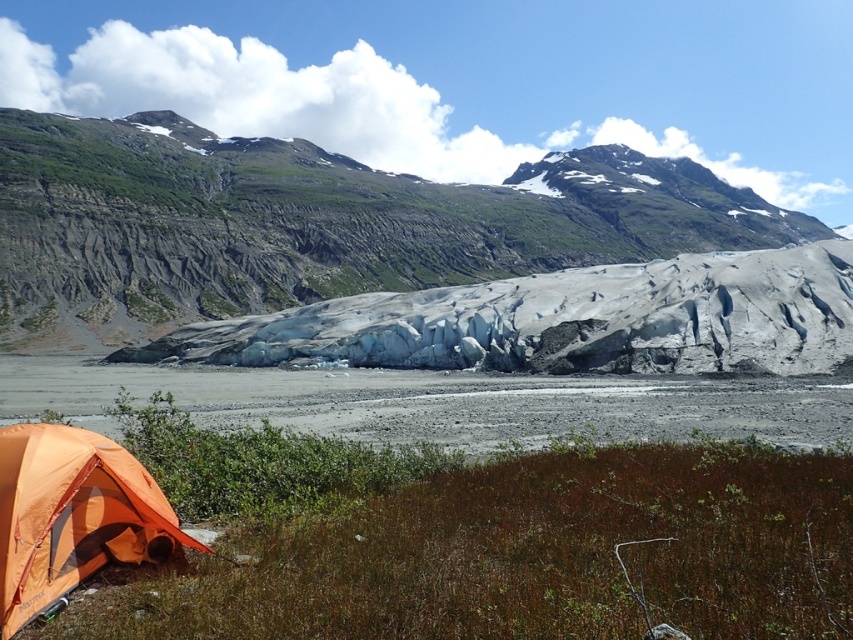
You are a mountaineer planning to set up a base camp near the gray rocky mountain at center. Given that the mountain is 135.21 meters away from your current position, would you consider this distance safe for setting up camp?

The gray rocky mountain at center is 135.21 meters away, so yes, setting up camp at this distance is safe as it is far enough to avoid immediate hazards like rockfalls or avalanches but close enough for accessibility.

You are standing at the base of the gray rocky mountain at center and want to reach the top. If your climbing gear can handle slopes up to 135 meters, will it be sufficient?

The gray rocky mountain at center is 135.21 meters from viewer. Your climbing gear can handle slopes up to 135 meters, so it may not be sufficient as the mountain is slightly taller than the gear capacity.